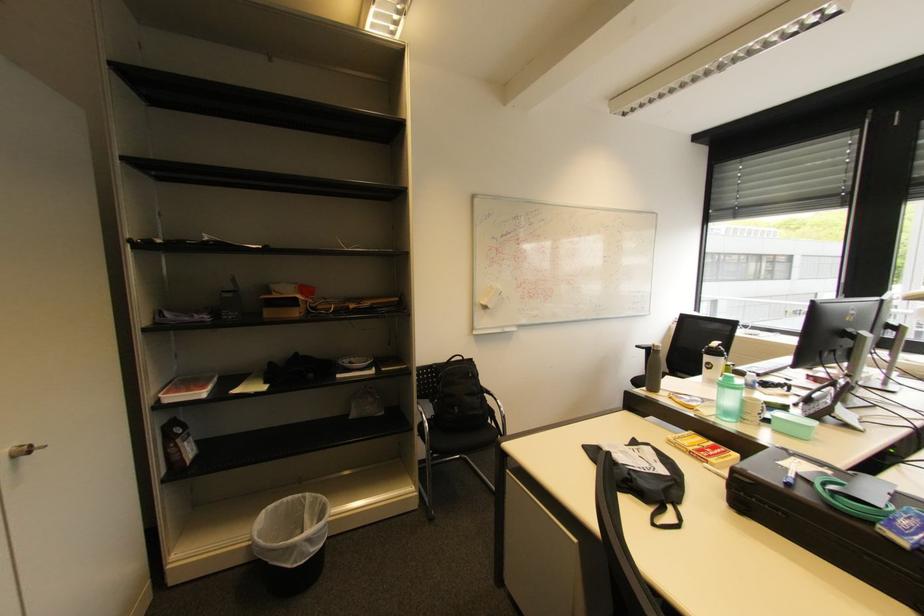
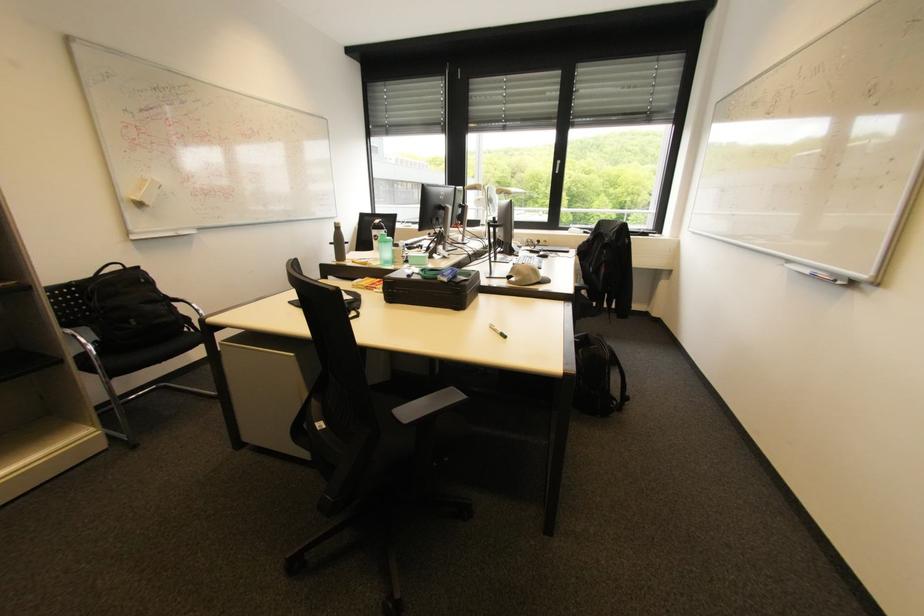
Question: How did the camera likely rotate?

Choices:
 (A) Left
 (B) Right
 (C) Up
 (D) Down

Answer: (B)